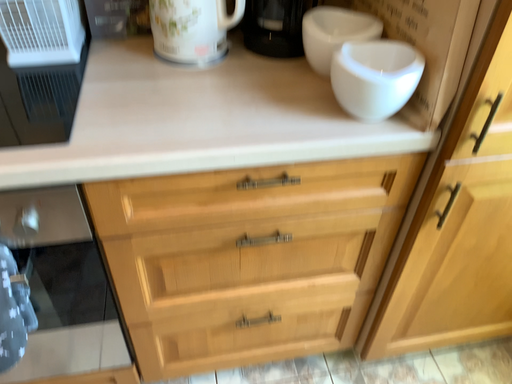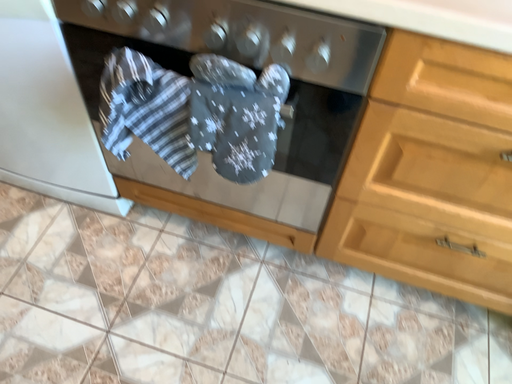
Question: How did the camera likely rotate when shooting the video?

Choices:
 (A) rotated right
 (B) rotated left

Answer: (B)